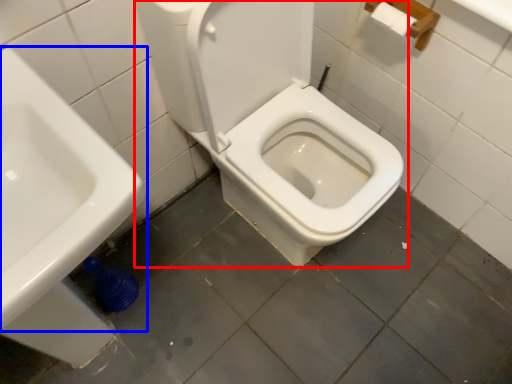
Question: Which of the following is the farthest to the observer, toilet (highlighted by a red box) or sink (highlighted by a blue box)?

Choices:
 (A) toilet
 (B) sink

Answer: (A)